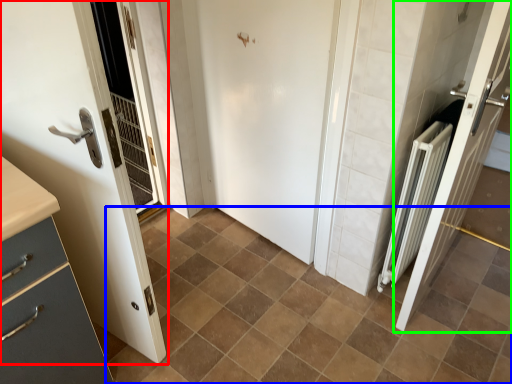
Question: Considering the real-world distances, which object is closest to door (highlighted by a red box)? ceramic tile (highlighted by a blue box) or door (highlighted by a green box).

Choices:
 (A) ceramic tile
 (B) door

Answer: (A)